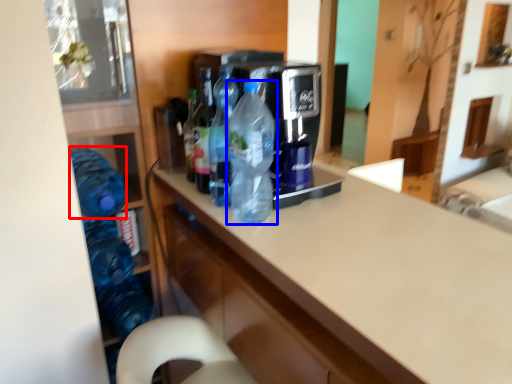
Question: Which of the following is the farthest to the observer, bottle (highlighted by a red box) or bottle (highlighted by a blue box)?

Choices:
 (A) bottle
 (B) bottle

Answer: (A)